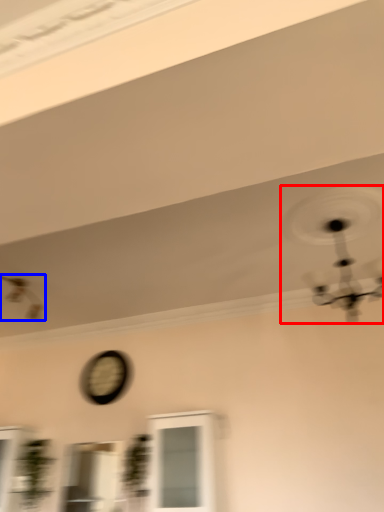
Question: Which point is closer to the camera, mechanical fan (highlighted by a red box) or mechanical fan (highlighted by a blue box)?

Choices:
 (A) mechanical fan
 (B) mechanical fan

Answer: (A)